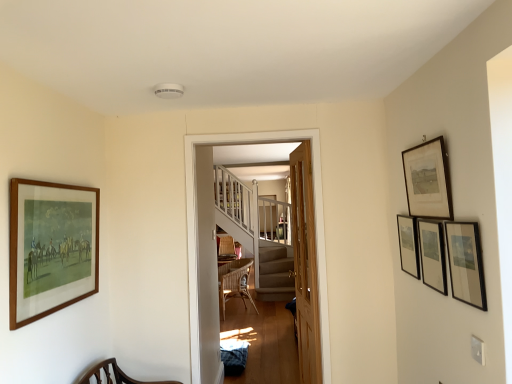
Question: From a real-world perspective, is matte black picture frame at right, positioned as the fourth picture frame in left-to-right order, physically above black matte picture frame at upper right, the 3th picture frame viewed from the left?

Choices:
 (A) yes
 (B) no

Answer: (A)

Question: Considering the relative sizes of matte black picture frame at right, which is the second picture frame from right to left, and black matte picture frame at upper right, acting as the 3th picture frame starting from the right, in the image provided, is matte black picture frame at right, which is the second picture frame from right to left, shorter than black matte picture frame at upper right, acting as the 3th picture frame starting from the right,?

Choices:
 (A) yes
 (B) no

Answer: (A)

Question: Can you confirm if matte black picture frame at right, positioned as the fourth picture frame in left-to-right order, is thinner than black matte picture frame at upper right, the 3th picture frame viewed from the left?

Choices:
 (A) yes
 (B) no

Answer: (B)

Question: Is matte black picture frame at right, positioned as the fourth picture frame in left-to-right order, directly adjacent to black matte picture frame at upper right, the 3th picture frame viewed from the left?

Choices:
 (A) yes
 (B) no

Answer: (B)

Question: Is matte black picture frame at right, which is the second picture frame from right to left, positioned behind black matte picture frame at upper right, acting as the 3th picture frame starting from the right?

Choices:
 (A) yes
 (B) no

Answer: (B)

Question: Is wooden staircase at center wider or thinner than light brown wooden door at center?

Choices:
 (A) thin
 (B) wide

Answer: (B)

Question: Is point (312, 168) closer or farther from the camera than point (301, 367)?

Choices:
 (A) farther
 (B) closer

Answer: (B)

Question: Visually, is wooden staircase at center positioned to the left or to the right of light brown wooden door at center?

Choices:
 (A) left
 (B) right

Answer: (A)

Question: Is wooden staircase at center bigger or smaller than light brown wooden door at center?

Choices:
 (A) big
 (B) small

Answer: (B)

Question: In terms of height, does woven rattan chair at center look taller or shorter compared to matte black picture frame at right, the first picture frame in the right-to-left sequence?

Choices:
 (A) tall
 (B) short

Answer: (A)

Question: From the image's perspective, is woven rattan chair at center above or below matte black picture frame at right, the first picture frame in the right-to-left sequence?

Choices:
 (A) below
 (B) above

Answer: (A)

Question: Relative to matte black picture frame at right, the first picture frame in the right-to-left sequence, is woven rattan chair at center in front or behind?

Choices:
 (A) front
 (B) behind

Answer: (B)

Question: Would you say woven rattan chair at center is to the left or to the right of matte black picture frame at right, the first picture frame in the right-to-left sequence, in the picture?

Choices:
 (A) left
 (B) right

Answer: (A)

Question: Is matte black picture frame at right, the first picture frame in the right-to-left sequence, inside the boundaries of light brown wooden door at center, or outside?

Choices:
 (A) outside
 (B) inside

Answer: (A)

Question: Is matte black picture frame at right, the first picture frame in the right-to-left sequence, wider or thinner than light brown wooden door at center?

Choices:
 (A) thin
 (B) wide

Answer: (A)